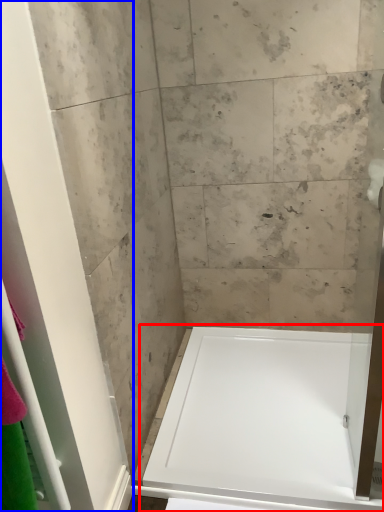
Question: Among these objects, which one is nearest to the camera, bathtub (highlighted by a red box) or screen door (highlighted by a blue box)?

Choices:
 (A) bathtub
 (B) screen door

Answer: (B)